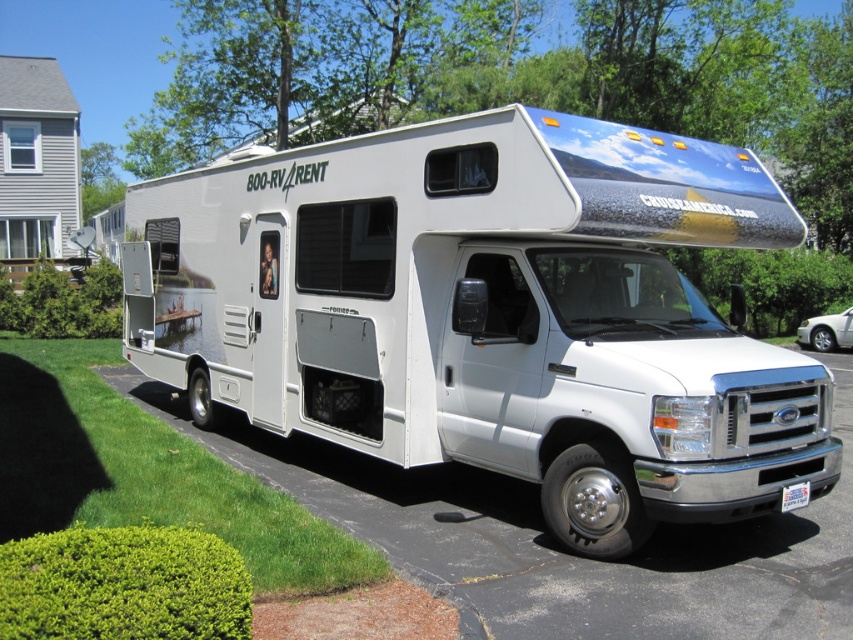
You are planning to park your car in the parking lot shown in the image. The car you are driving is the same size as the white asphalt driveway at lower center. Can you safely park your car next to the white glossy recreational vehicle at center without overlapping?

The white glossy recreational vehicle at center is bigger than the white asphalt driveway at lower center. Since your car is the same size as the driveway, parking next to the larger RV may result in insufficient space. Please ensure there is enough room before attempting to park.

You are a delivery person trying to park a tall delivery truck behind the white glossy recreational vehicle at center. The truck is 2 meters tall. Can the truck pass over the white asphalt driveway at lower center without hitting the recreational vehicle?

The white glossy recreational vehicle at center has a greater height compared to the white asphalt driveway at lower center. Since the truck is 2 meters tall, it may hit the recreational vehicle if it is taller than 2 meters. However, the exact height of the RV is not provided, so it is uncertain whether the truck can pass safely.

You are standing in front of the white Ford RV parked on a paved surface adjacent to a grassy area. You need to locate the exact point at coordinates (490,314). Which object is located at this point?

The point at coordinates (490,314) corresponds to the white glossy recreational vehicle at center.